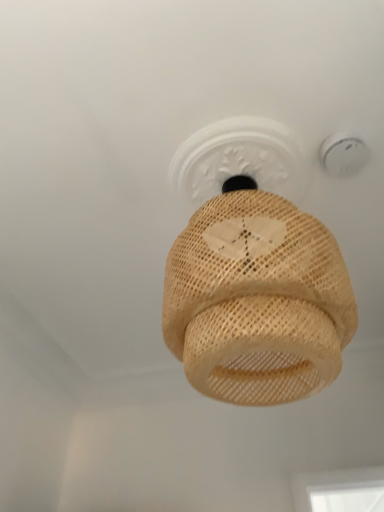
Question: From the image's perspective, is white plastic smoke detector at upper right located above or below natural woven lampshade at center?

Choices:
 (A) below
 (B) above

Answer: (B)

Question: Is white plastic smoke detector at upper right bigger or smaller than natural woven lampshade at center?

Choices:
 (A) big
 (B) small

Answer: (B)

Question: Is white plastic smoke detector at upper right situated inside natural woven lampshade at center or outside?

Choices:
 (A) outside
 (B) inside

Answer: (A)

Question: Based on their positions, is natural woven lampshade at center located to the left or right of white plastic smoke detector at upper right?

Choices:
 (A) right
 (B) left

Answer: (B)

Question: From a real-world perspective, is natural woven lampshade at center physically located above or below white plastic smoke detector at upper right?

Choices:
 (A) above
 (B) below

Answer: (B)

Question: Is natural woven lampshade at center taller or shorter than white plastic smoke detector at upper right?

Choices:
 (A) tall
 (B) short

Answer: (A)

Question: Does point (195, 169) appear closer or farther from the camera than point (319, 150)?

Choices:
 (A) farther
 (B) closer

Answer: (A)